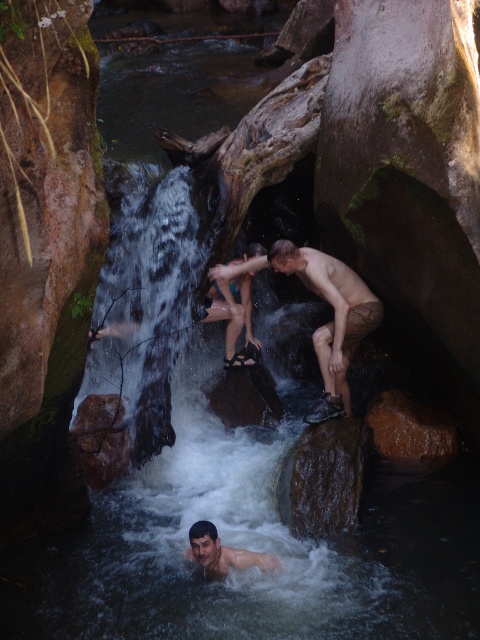
Question: Is smooth skin man at center further to camera compared to smooth skin man at lower center?

Choices:
 (A) no
 (B) yes

Answer: (B)

Question: Does smooth skin man at center have a greater width compared to smooth skin man at lower center?

Choices:
 (A) no
 (B) yes

Answer: (B)

Question: Which of the following is the closest to the observer?

Choices:
 (A) smooth skin man at lower center
 (B) smooth skin man at center

Answer: (A)

Question: From the image, what is the correct spatial relationship of smooth skin man at center in relation to smooth skin man at lower center?

Choices:
 (A) above
 (B) below

Answer: (A)